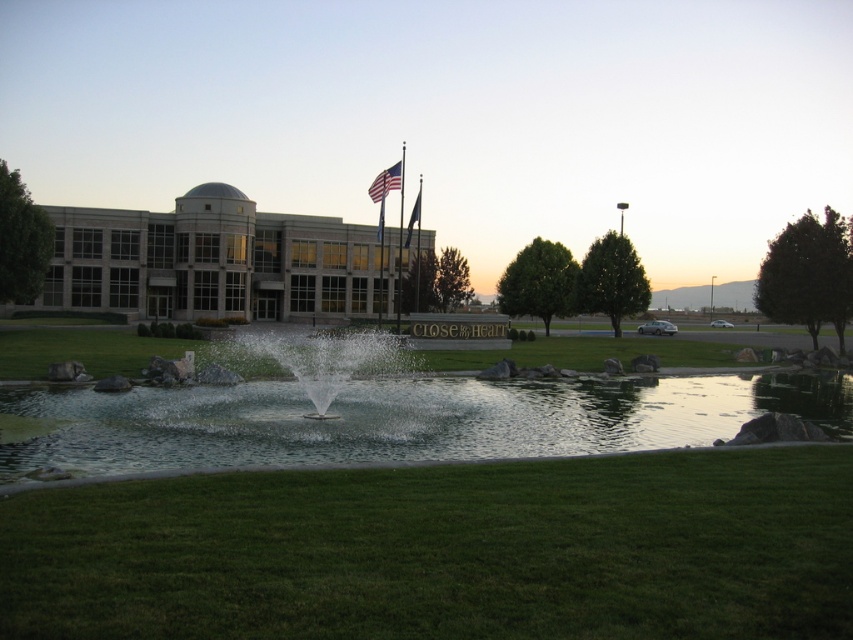
Question: Which is farther from the blue fabric flag at upper center?

Choices:
 (A) clear water at center
 (B) clear water fountain at center
 (C) american flag at upper center
 (D) green grass at center

Answer: (D)

Question: Among these objects, which one is nearest to the camera?

Choices:
 (A) clear water at center
 (B) green grass at center
 (C) clear water fountain at center
 (D) american flag at upper center

Answer: (B)

Question: Does clear water fountain at center appear on the right side of metallic flag pole at center?

Choices:
 (A) no
 (B) yes

Answer: (B)

Question: Observing the image, what is the correct spatial positioning of green grass at center in reference to clear water at center?

Choices:
 (A) right
 (B) left

Answer: (A)

Question: Does clear water at center have a lesser width compared to metallic flag pole at center?

Choices:
 (A) yes
 (B) no

Answer: (B)

Question: Which object is closer to the camera taking this photo?

Choices:
 (A) clear water fountain at center
 (B) blue fabric flag at upper center
 (C) metallic flag pole at center

Answer: (A)